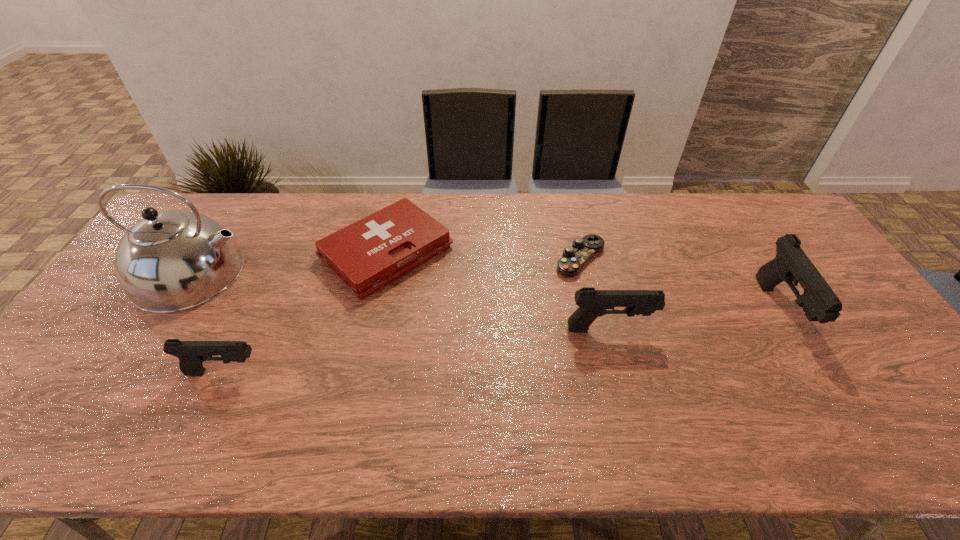
The height and width of the screenshot is (540, 960). What are the coordinates of `blank space located 0.290m at the barrel of the second pistol from left to right` in the screenshot? It's located at (759, 329).

You are a GUI agent. You are given a task and a screenshot of the screen. Output one action in this format:
    pyautogui.click(x=<x>, y=<y>)
    Task: Click on the free location located 0.150m at the barrel of the rightmost object
    The height and width of the screenshot is (540, 960).
    Given the screenshot: What is the action you would take?
    pyautogui.click(x=836, y=403)

Find the location of a particular element. free spot located 0.170m on the front of the second shortest object is located at coordinates (365, 353).

Image resolution: width=960 pixels, height=540 pixels. In order to click on vacant space situated from the spout of the tallest object in this screenshot , I will do `click(269, 273)`.

Locate an element on the screen. vacant space situated 0.120m on the left of the control is located at coordinates (516, 258).

Identify the location of object located at the far edge. This screenshot has height=540, width=960. (367, 255).

Image resolution: width=960 pixels, height=540 pixels. I want to click on object at the near edge, so click(x=191, y=354).

Locate an element on the screen. Image resolution: width=960 pixels, height=540 pixels. object that is at the left edge is located at coordinates (171, 261).

In the image, there is a desktop. Where is `vacant space at the far edge`? Image resolution: width=960 pixels, height=540 pixels. vacant space at the far edge is located at coordinates coord(540,231).

Locate an element on the screen. The height and width of the screenshot is (540, 960). free spot at the near edge of the desktop is located at coordinates (756, 381).